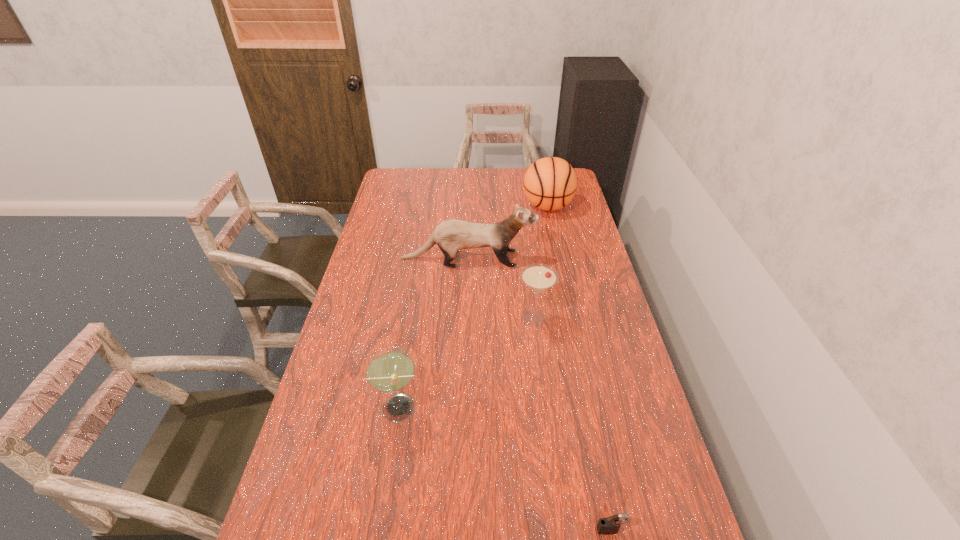
The height and width of the screenshot is (540, 960). I want to click on free space that satisfies the following two spatial constraints: 1. on the face of the fourth nearest object; 2. on the front side of the nearer martini, so click(x=464, y=408).

The width and height of the screenshot is (960, 540). I want to click on free space that satisfies the following two spatial constraints: 1. on the back side of the third nearest object; 2. on the face of the fourth nearest object, so click(x=527, y=259).